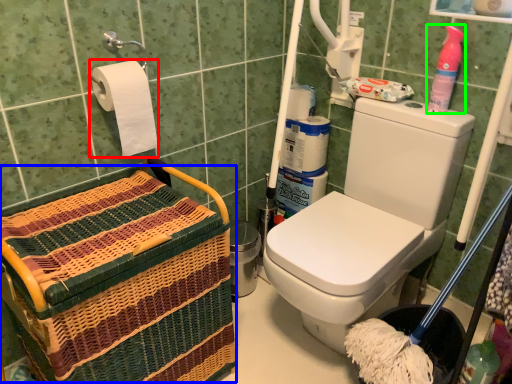
Question: Estimate the real-world distances between objects in this image. Which object is farther from toilet paper (highlighted by a red box), basket (highlighted by a blue box) or cleaning product (highlighted by a green box)?

Choices:
 (A) basket
 (B) cleaning product

Answer: (B)